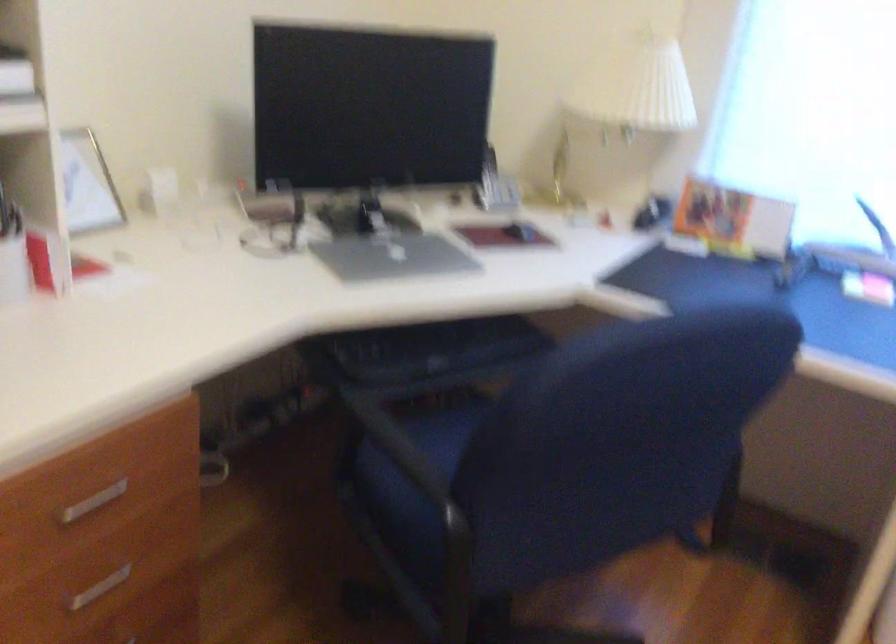
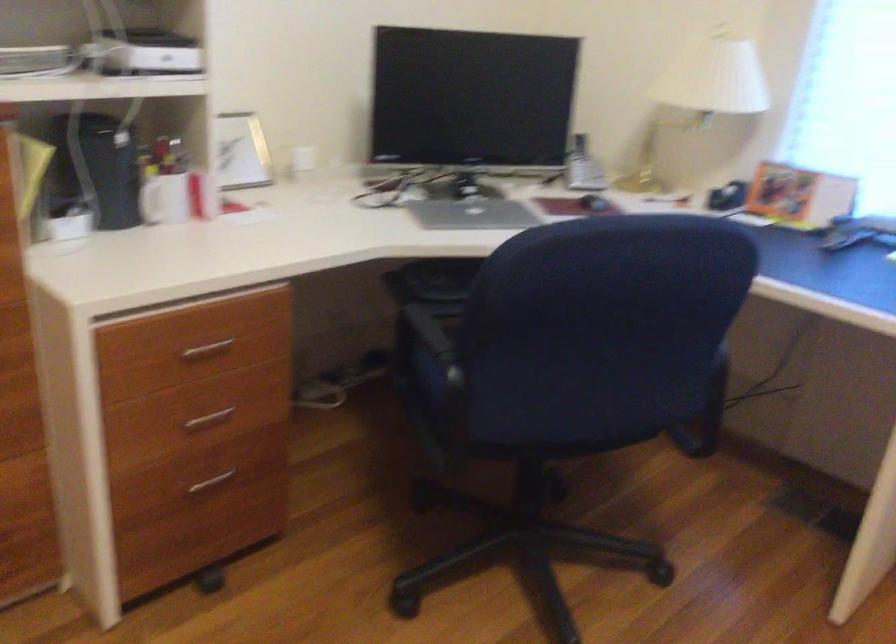
Question: The camera is either moving clockwise (left) or counter-clockwise (right) around the object. The first image is from the beginning of the video and the second image is from the end. Is the camera moving left or right when shooting the video?

Choices:
 (A) Left
 (B) Right

Answer: (B)